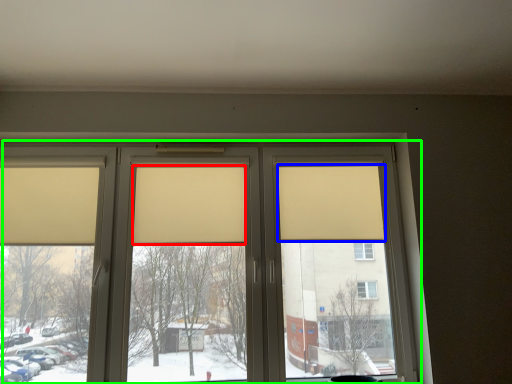
Question: Which object is the farthest from curtain (highlighted by a red box)? Choose among these: curtain (highlighted by a blue box) or window (highlighted by a green box).

Choices:
 (A) curtain
 (B) window

Answer: (A)